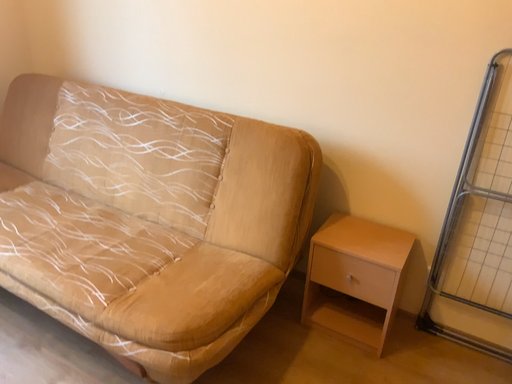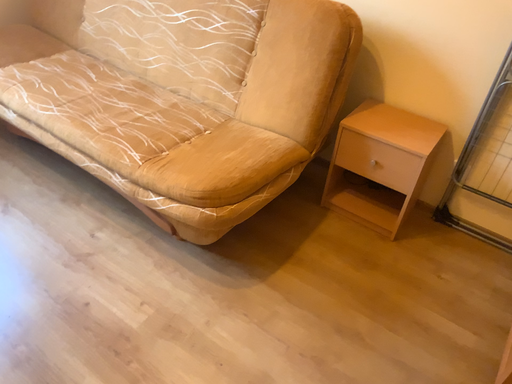
Question: How did the camera likely rotate when shooting the video?

Choices:
 (A) rotated upward
 (B) rotated downward

Answer: (B)